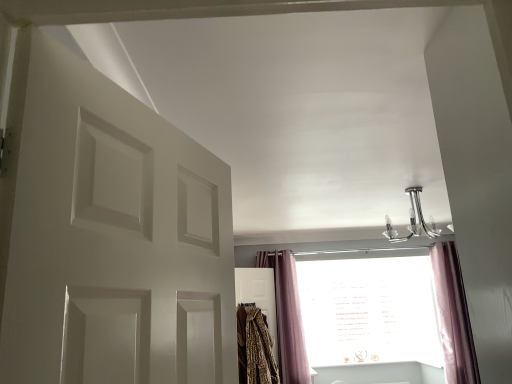
What do you see at coordinates (287, 317) in the screenshot?
I see `purple velvet curtain at lower right, the 2th curtain from the right` at bounding box center [287, 317].

The image size is (512, 384). What do you see at coordinates (453, 316) in the screenshot? I see `pink velvet curtain at lower right, which appears as the 1th curtain when viewed from the right` at bounding box center [453, 316].

Image resolution: width=512 pixels, height=384 pixels. I want to click on chrome metallic chandelier at upper center, so click(413, 220).

Describe the element at coordinates (255, 347) in the screenshot. I see `leopard print blanket at center` at that location.

Identify the location of purple velvet curtain at lower right, the 2th curtain from the right. (287, 317).

Can you confirm if pink velvet curtain at lower right, which appears as the 1th curtain when viewed from the right, is positioned to the left of white matte door at left?

No, pink velvet curtain at lower right, which appears as the 1th curtain when viewed from the right, is not to the left of white matte door at left.

Can you tell me how much pink velvet curtain at lower right, the second curtain from the left, and white matte door at left differ in facing direction?

69.4 degrees.

Would you say pink velvet curtain at lower right, the second curtain from the left, is inside or outside white matte door at left?

pink velvet curtain at lower right, the second curtain from the left, is outside white matte door at left.

Is pink velvet curtain at lower right, the second curtain from the left, not close to white matte door at left?

No, pink velvet curtain at lower right, the second curtain from the left, is not far from white matte door at left.

Is white matte door at left not within chrome metallic chandelier at upper center?

That's correct, white matte door at left is outside of chrome metallic chandelier at upper center.

Between white matte door at left and chrome metallic chandelier at upper center, which one has more height?

white matte door at left is taller.

From the image's perspective, relative to chrome metallic chandelier at upper center, is purple velvet curtain at lower right, the 2th curtain from the right, above or below?

purple velvet curtain at lower right, the 2th curtain from the right, is situated lower than chrome metallic chandelier at upper center in the image.

Does purple velvet curtain at lower right, the 2th curtain from the right, contain chrome metallic chandelier at upper center?

Actually, chrome metallic chandelier at upper center is outside purple velvet curtain at lower right, the 2th curtain from the right.

Which is nearer, (259, 267) or (410, 191)?

The point (410, 191) is closer.

Between purple velvet curtain at lower right, positioned as the first curtain in left-to-right order, and chrome metallic chandelier at upper center, which one has less height?

chrome metallic chandelier at upper center.

From a real-world perspective, is leopard print blanket at center positioned over purple velvet curtain at lower right, positioned as the first curtain in left-to-right order, based on gravity?

Actually, leopard print blanket at center is physically below purple velvet curtain at lower right, positioned as the first curtain in left-to-right order, in the real world.

Can you confirm if leopard print blanket at center is bigger than purple velvet curtain at lower right, positioned as the first curtain in left-to-right order?

Incorrect, leopard print blanket at center is not larger than purple velvet curtain at lower right, positioned as the first curtain in left-to-right order.

Does point (250, 382) come in front of point (304, 369)?

Yes, it is.

Can we say leopard print blanket at center lies outside pink velvet curtain at lower right, which appears as the 1th curtain when viewed from the right?

That's correct, leopard print blanket at center is outside of pink velvet curtain at lower right, which appears as the 1th curtain when viewed from the right.

In the scene shown: From the image's perspective, between leopard print blanket at center and pink velvet curtain at lower right, the second curtain from the left, who is located below?

leopard print blanket at center.

Would you consider leopard print blanket at center to be distant from pink velvet curtain at lower right, the second curtain from the left?

Yes, leopard print blanket at center is far from pink velvet curtain at lower right, the second curtain from the left.

Which is behind, point (431, 234) or point (446, 341)?

The point (431, 234) is behind.

From the image's perspective, does chrome metallic chandelier at upper center appear higher than pink velvet curtain at lower right, the second curtain from the left?

Indeed, from the image's perspective, chrome metallic chandelier at upper center is shown above pink velvet curtain at lower right, the second curtain from the left.

Considering the relative sizes of chrome metallic chandelier at upper center and pink velvet curtain at lower right, the second curtain from the left, in the image provided, is chrome metallic chandelier at upper center wider than pink velvet curtain at lower right, the second curtain from the left,?

Yes.

Which of these two, leopard print blanket at center or white matte door at left, is wider?

Wider between the two is leopard print blanket at center.

Between leopard print blanket at center and white matte door at left, which one has more height?

Standing taller between the two is leopard print blanket at center.

Is white matte door at left located within leopard print blanket at center?

No, white matte door at left is located outside of leopard print blanket at center.

Which object is positioned more to the left, leopard print blanket at center or white matte door at left?

white matte door at left.

Identify the location of door positioned vertically above the pink velvet curtain at lower right, the second curtain from the left (from a real-world perspective). (109, 235).

This screenshot has height=384, width=512. I want to click on door in front of the chrome metallic chandelier at upper center, so click(109, 235).

Which object lies further to the anchor point chrome metallic chandelier at upper center, white matte door at left or pink velvet curtain at lower right, the second curtain from the left?

white matte door at left.

Looking at the image, which one is located closer to purple velvet curtain at lower right, positioned as the first curtain in left-to-right order, leopard print blanket at center or pink velvet curtain at lower right, the second curtain from the left?

Among the two, leopard print blanket at center is located nearer to purple velvet curtain at lower right, positioned as the first curtain in left-to-right order.

When comparing their distances from white matte door at left, does chrome metallic chandelier at upper center or pink velvet curtain at lower right, which appears as the 1th curtain when viewed from the right, seem further?

Among the two, chrome metallic chandelier at upper center is located further to white matte door at left.

Considering their positions, is chrome metallic chandelier at upper center positioned closer to pink velvet curtain at lower right, the second curtain from the left, than purple velvet curtain at lower right, the 2th curtain from the right?

chrome metallic chandelier at upper center is positioned closer to the anchor pink velvet curtain at lower right, the second curtain from the left.

Estimate the real-world distances between objects in this image. Which object is further from chrome metallic chandelier at upper center, purple velvet curtain at lower right, the 2th curtain from the right, or white matte door at left?

white matte door at left lies further to chrome metallic chandelier at upper center than the other object.

When comparing their distances from leopard print blanket at center, does white matte door at left or purple velvet curtain at lower right, the 2th curtain from the right, seem closer?

Based on the image, purple velvet curtain at lower right, the 2th curtain from the right, appears to be nearer to leopard print blanket at center.

Considering their positions, is white matte door at left positioned closer to chrome metallic chandelier at upper center than purple velvet curtain at lower right, the 2th curtain from the right?

purple velvet curtain at lower right, the 2th curtain from the right, is positioned closer to the anchor chrome metallic chandelier at upper center.

Estimate the real-world distances between objects in this image. Which object is further from white matte door at left, chrome metallic chandelier at upper center or purple velvet curtain at lower right, positioned as the first curtain in left-to-right order?

Based on the image, purple velvet curtain at lower right, positioned as the first curtain in left-to-right order, appears to be further to white matte door at left.

Where is `blanket positioned between white matte door at left and purple velvet curtain at lower right, the 2th curtain from the right, from near to far`? blanket positioned between white matte door at left and purple velvet curtain at lower right, the 2th curtain from the right, from near to far is located at coordinates (255, 347).

Locate an element on the screen. The width and height of the screenshot is (512, 384). light fixture between white matte door at left and purple velvet curtain at lower right, the 2th curtain from the right, in the front-back direction is located at coordinates (413, 220).

Locate an element on the screen. This screenshot has width=512, height=384. curtain between white matte door at left and purple velvet curtain at lower right, the 2th curtain from the right, along the z-axis is located at coordinates (453, 316).

Identify the location of light fixture between white matte door at left and leopard print blanket at center from front to back. Image resolution: width=512 pixels, height=384 pixels. (413, 220).